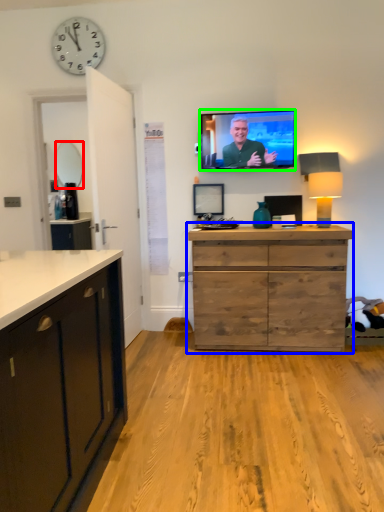
Question: Which is nearer to the mirror (highlighted by a red box)? chest of drawers (highlighted by a blue box) or television (highlighted by a green box).

Choices:
 (A) chest of drawers
 (B) television

Answer: (B)